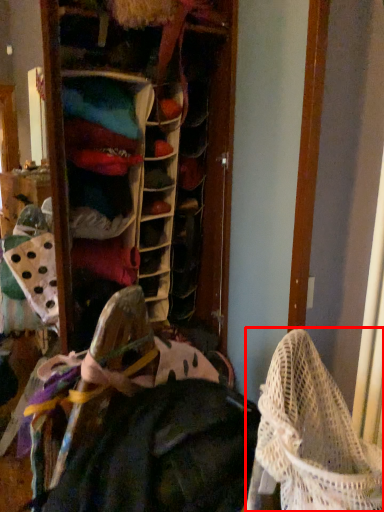
Question: From the image's perspective, considering the relative positions of baby carriage (annotated by the red box) and clothing in the image provided, where is baby carriage (annotated by the red box) located with respect to the staircase?

Choices:
 (A) above
 (B) below

Answer: (A)